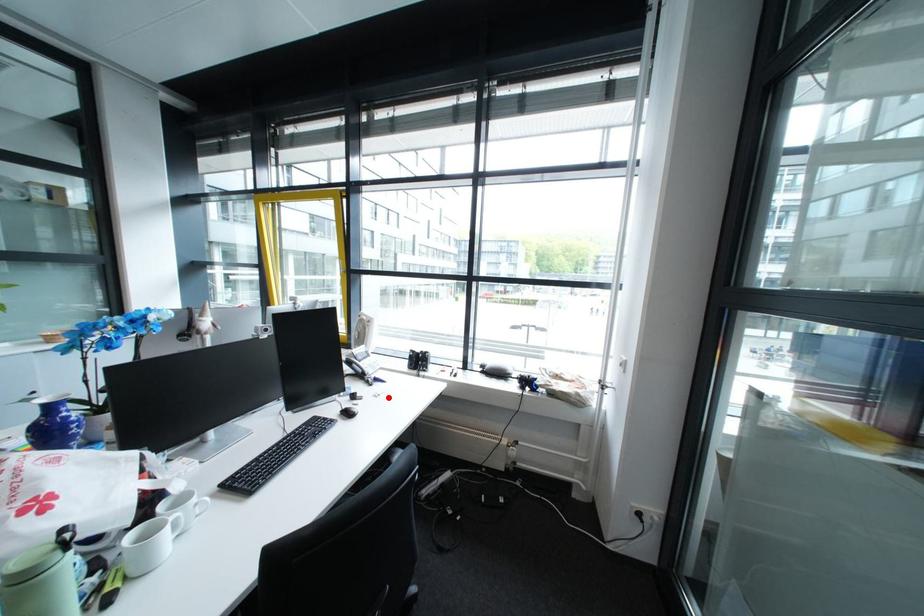
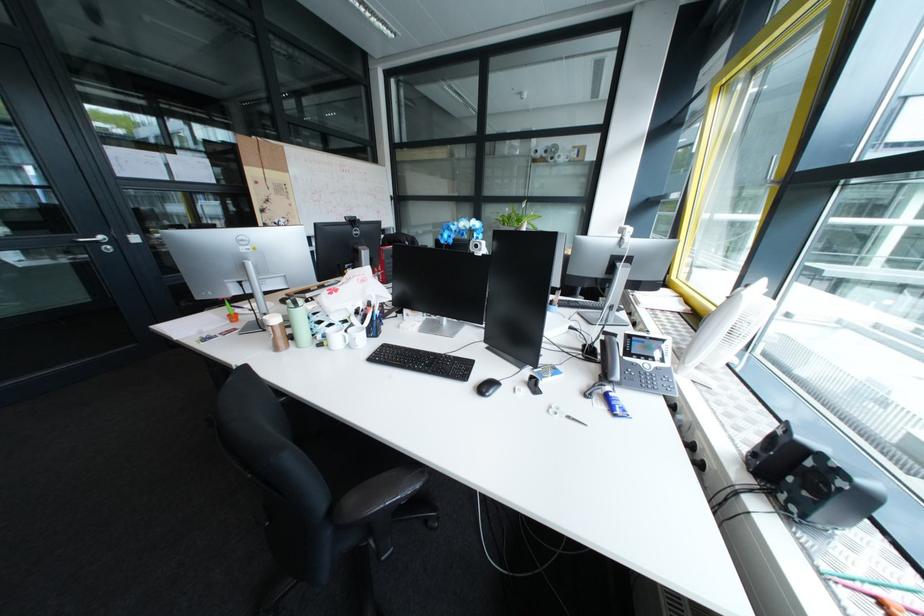
Where in the second image is the point corresponding to the highlighted location from the first image?

(560, 408)